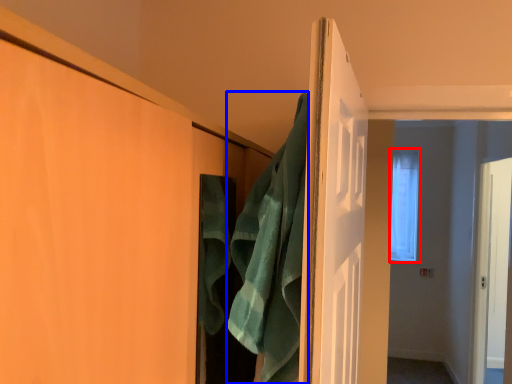
Question: Which point is closer to the camera, window (highlighted by a red box) or bath towel (highlighted by a blue box)?

Choices:
 (A) window
 (B) bath towel

Answer: (B)